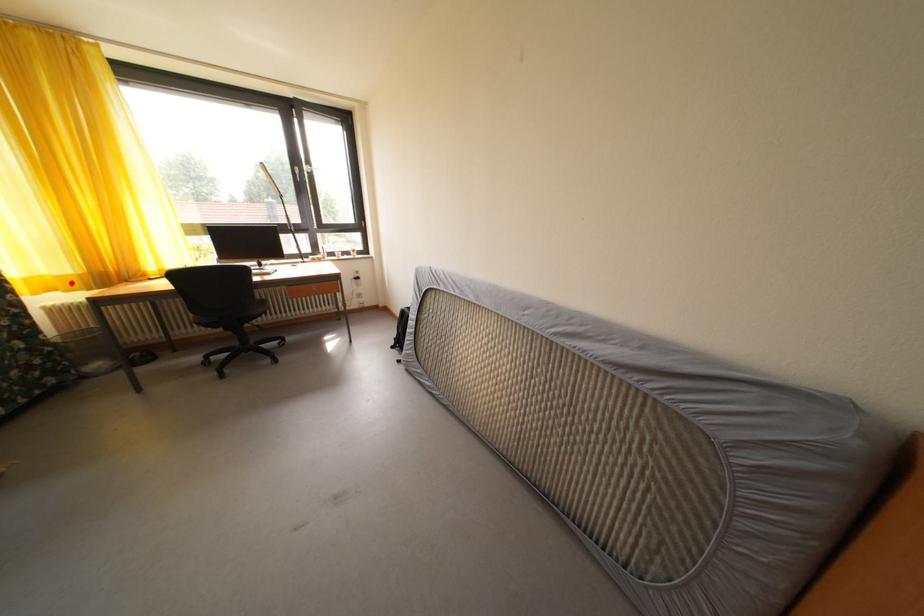
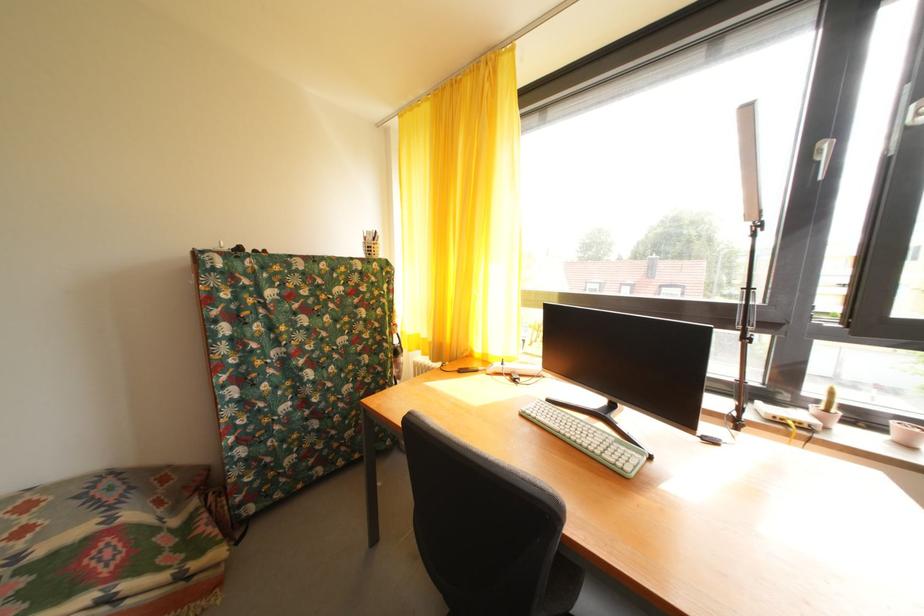
In the second image, find the point that corresponds to the highlighted location in the first image.

(432, 346)